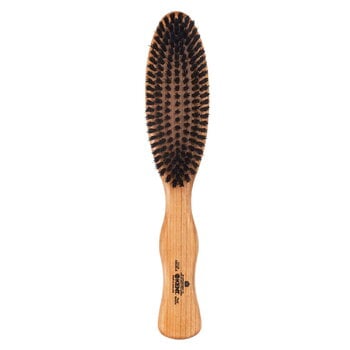
Identify the location of handle. (185, 319).